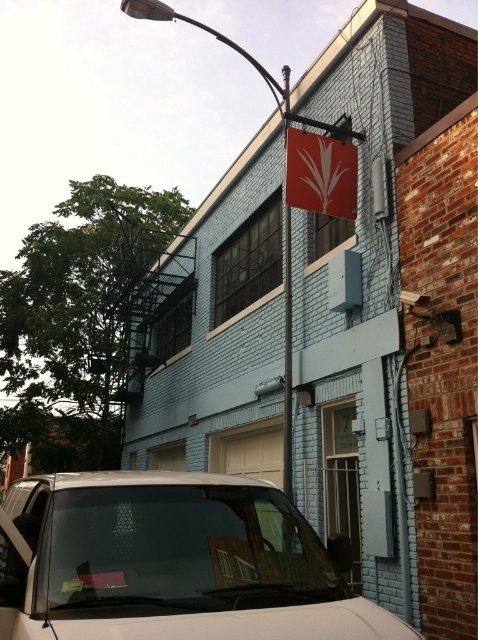
You are standing in front of the building and want to take a photo. There are two points marked on the building. The first point is at coordinate point (x=203, y=550) and the second is at point (x=329, y=157). Which point will appear larger in your photo?

Point (x=203, y=550) is closer to the camera than point (x=329, y=157), so it will appear larger in the photo.

Looking at this image, you are a delivery person trying to park your car in front of the building. The white matte car at lower left is already parked there. Can you see the red matte sign at upper center from your current position?

Yes, because the white matte car at lower left is located below the red matte sign at upper center, so the sign is above the car and visible from the parking spot.